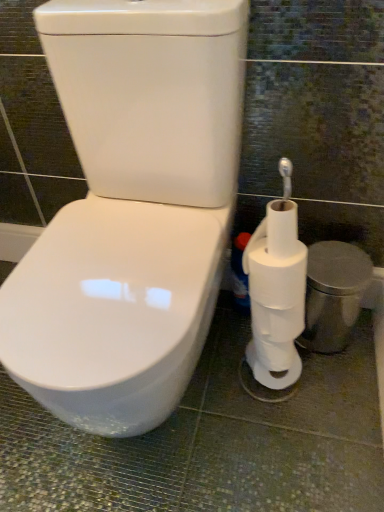
Question: From a real-world perspective, is white plastic bottle at lower right above or below white matte toilet paper at right?

Choices:
 (A) below
 (B) above

Answer: (A)

Question: Considering the positions of white plastic bottle at lower right and white matte toilet paper at right in the image, is white plastic bottle at lower right taller or shorter than white matte toilet paper at right?

Choices:
 (A) short
 (B) tall

Answer: (B)

Question: Is white plastic bottle at lower right situated inside white matte toilet paper at right or outside?

Choices:
 (A) outside
 (B) inside

Answer: (A)

Question: From the image's perspective, is white matte toilet paper at right above or below white plastic bottle at lower right?

Choices:
 (A) above
 (B) below

Answer: (A)

Question: In terms of size, does white matte toilet paper at right appear bigger or smaller than white plastic bottle at lower right?

Choices:
 (A) big
 (B) small

Answer: (A)

Question: Is white matte toilet paper at right wider or thinner than white plastic bottle at lower right?

Choices:
 (A) thin
 (B) wide

Answer: (B)

Question: Considering the positions of white matte toilet paper at right and white plastic bottle at lower right in the image, is white matte toilet paper at right taller or shorter than white plastic bottle at lower right?

Choices:
 (A) short
 (B) tall

Answer: (A)